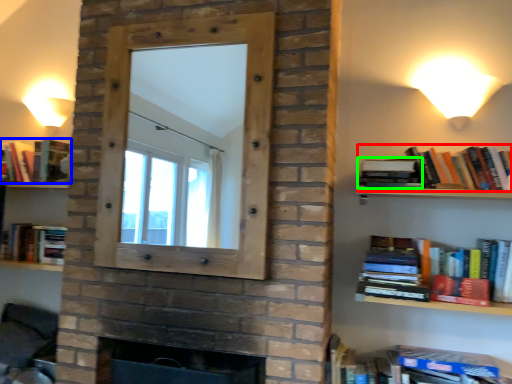
Question: Which object is positioned closest to book (highlighted by a red box)? Select from book (highlighted by a blue box) and book (highlighted by a green box).

Choices:
 (A) book
 (B) book

Answer: (B)